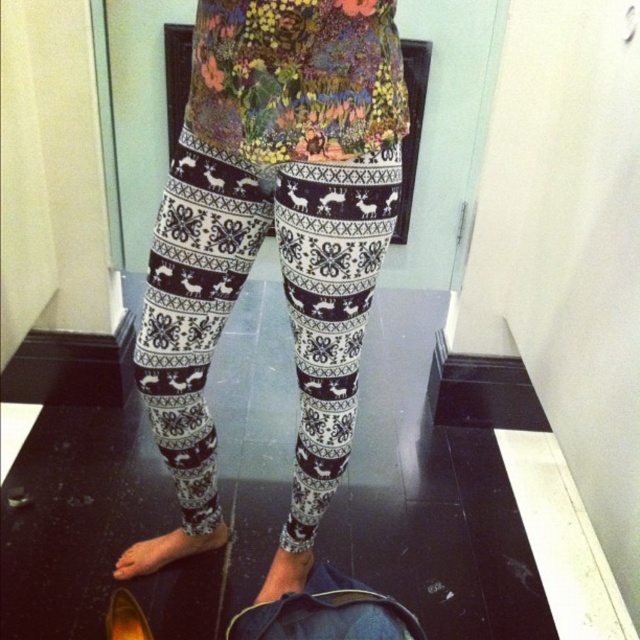
Question: Among these points, which one is nearest to the camera?

Choices:
 (A) (182, 200)
 (B) (109, 600)

Answer: (A)

Question: Is the position of white printed leggings at center less distant than that of gold metallic shoe at lower left?

Choices:
 (A) yes
 (B) no

Answer: (A)

Question: Does white printed leggings at center appear under gold metallic shoe at lower left?

Choices:
 (A) no
 (B) yes

Answer: (A)

Question: Which point is closer to the camera taking this photo?

Choices:
 (A) (298, 236)
 (B) (120, 600)

Answer: (A)

Question: Which point is farther from the camera taking this photo?

Choices:
 (A) (186, 444)
 (B) (134, 604)

Answer: (A)

Question: Can you confirm if white printed leggings at center is positioned above gold metallic shoe at lower left?

Choices:
 (A) no
 (B) yes

Answer: (B)